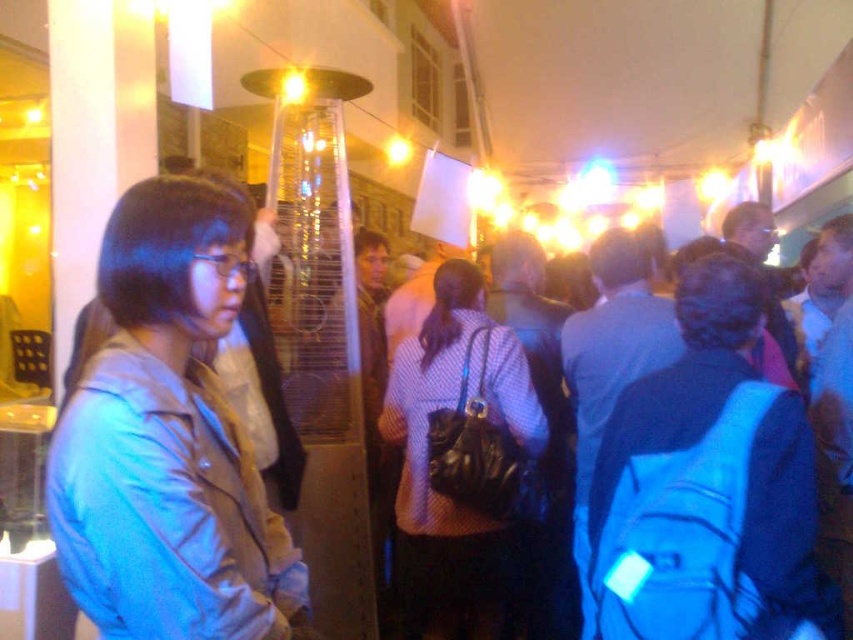
Is point (194, 337) positioned after point (506, 556)?

No, (194, 337) is closer to viewer.

Between matte gray jacket at left and polka dot shirt at center, which one appears on the left side from the viewer's perspective?

Positioned to the left is matte gray jacket at left.

Locate an element on the screen. The width and height of the screenshot is (853, 640). matte gray jacket at left is located at coordinates (167, 438).

You are a GUI agent. You are given a task and a screenshot of the screen. Output one action in this format:
    pyautogui.click(x=<x>, y=<y>)
    Task: Click on the matte gray jacket at left
    Image resolution: width=853 pixels, height=640 pixels.
    Given the screenshot: What is the action you would take?
    pyautogui.click(x=167, y=438)